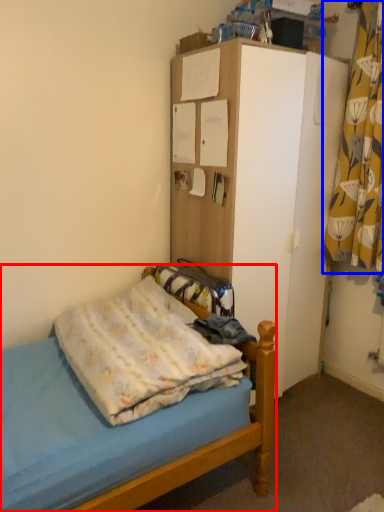
Question: Which object appears closest to the camera in this image, bed (highlighted by a red box) or curtain (highlighted by a blue box)?

Choices:
 (A) bed
 (B) curtain

Answer: (A)